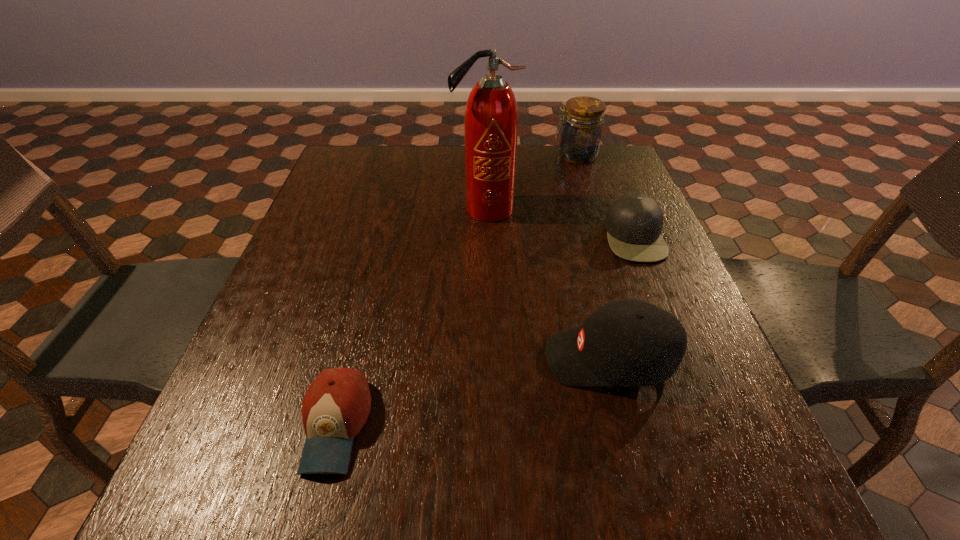
This screenshot has height=540, width=960. Find the location of `free region that satisfies the following two spatial constraints: 1. on the brim of the cap; 2. on the front-facing side of the leftmost object`. free region that satisfies the following two spatial constraints: 1. on the brim of the cap; 2. on the front-facing side of the leftmost object is located at coordinates (709, 425).